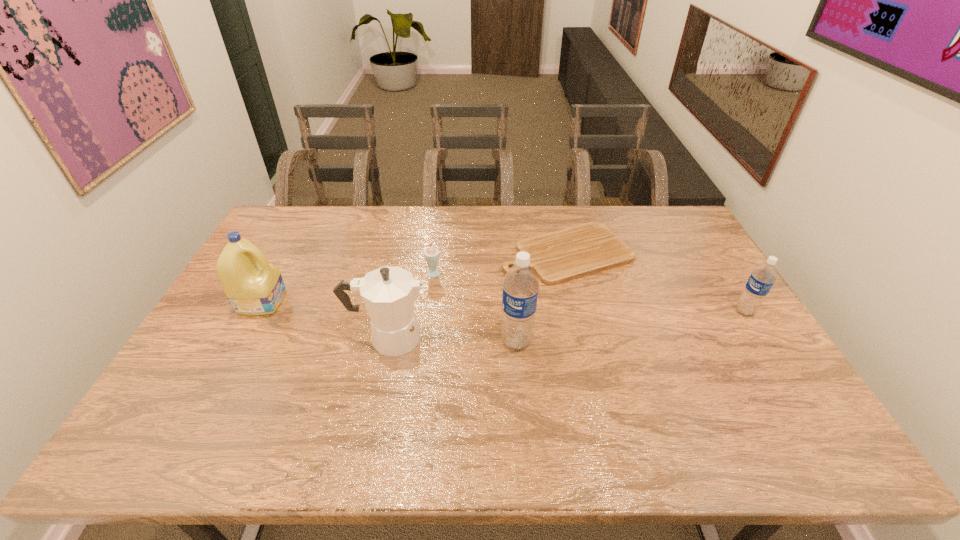
Locate an element on the screen. free point that satisfies the following two spatial constraints: 1. on the back side of the nearer water bottle; 2. on the label of the detergent is located at coordinates (513, 301).

Find the location of a particular element. free space that satisfies the following two spatial constraints: 1. on the straw side of the fifth tallest object; 2. on the label of the detergent is located at coordinates (433, 301).

Locate an element on the screen. Image resolution: width=960 pixels, height=540 pixels. free space that satisfies the following two spatial constraints: 1. on the straw side of the milkshake; 2. at the spout of the coffeepot is located at coordinates [428, 338].